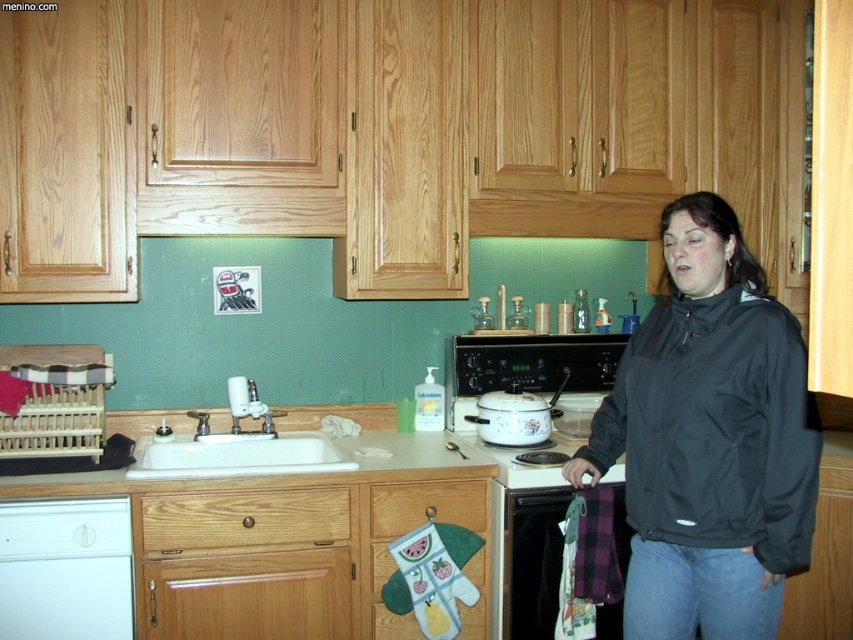
Is point (581, 458) closer to camera compared to point (271, 417)?

Yes.

Is point (776, 445) positioned after point (303, 467)?

No, it is not.

Locate an element on the screen. This screenshot has width=853, height=640. black matte jacket at center is located at coordinates (709, 440).

Which of these two, black matte jacket at center or metallic silver oven at lower center, stands taller?

black matte jacket at center is taller.

From the picture: Does black matte jacket at center have a greater width compared to metallic silver oven at lower center?

Yes.

Locate an element on the screen. This screenshot has height=640, width=853. black matte jacket at center is located at coordinates (709, 440).

This screenshot has width=853, height=640. I want to click on black matte jacket at center, so click(x=709, y=440).

Is black matte jacket at center further to the viewer compared to white glossy pot at center?

No, black matte jacket at center is in front of white glossy pot at center.

Which of these two, black matte jacket at center or white glossy pot at center, stands shorter?

Standing shorter between the two is white glossy pot at center.

Is point (668, 541) farther from camera compared to point (561, 444)?

That is False.

Find the location of a particular element. This screenshot has width=853, height=640. black matte jacket at center is located at coordinates (709, 440).